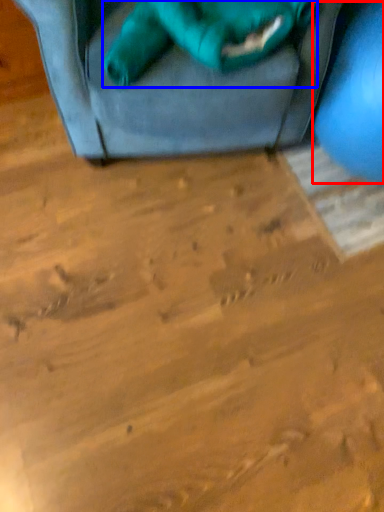
Question: Which point is further to the camera, turquoise (highlighted by a red box) or animal (highlighted by a blue box)?

Choices:
 (A) turquoise
 (B) animal

Answer: (B)